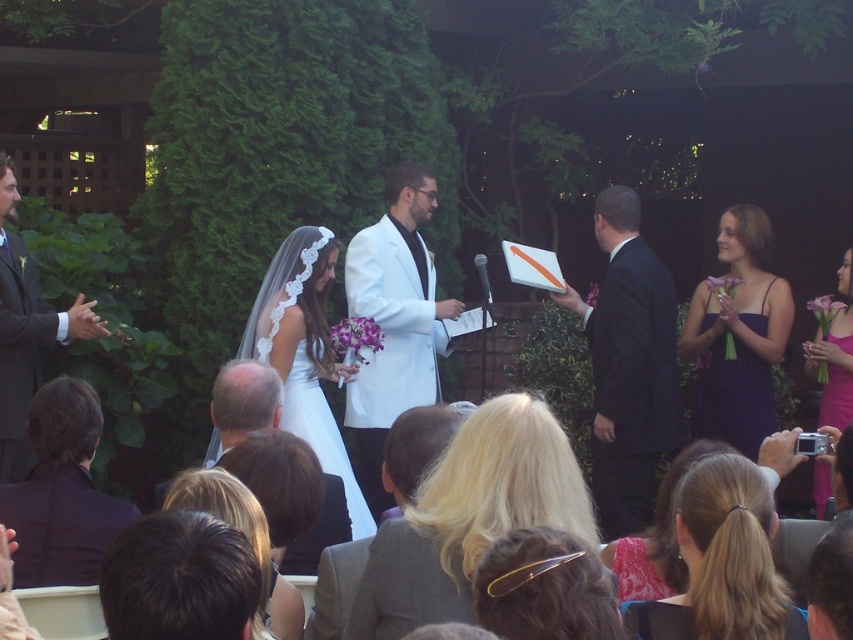
Between blonde hair at lower right and floral lace dress at center, which one appears on the left side from the viewer's perspective?

Positioned to the left is floral lace dress at center.

Is blonde hair at lower right to the left of floral lace dress at center from the viewer's perspective?

No, blonde hair at lower right is not to the left of floral lace dress at center.

The image size is (853, 640). Identify the location of blonde hair at lower right. (722, 561).

Is point (393, 348) less distant than point (718, 284)?

That is False.

From the picture: Who is more distant from viewer, [369,452] or [724,436]?

Point [369,452]

What do you see at coordinates (393, 321) in the screenshot?
I see `white satin tuxedo at center` at bounding box center [393, 321].

Where is `white satin tuxedo at center`? This screenshot has width=853, height=640. white satin tuxedo at center is located at coordinates (393, 321).

Is black suit at right above smooth gray suit at center?

Yes, black suit at right is above smooth gray suit at center.

Does point (660, 381) lie behind point (341, 506)?

Yes, it is behind point (341, 506).

This screenshot has height=640, width=853. Find the location of `black suit at right`. black suit at right is located at coordinates (628, 365).